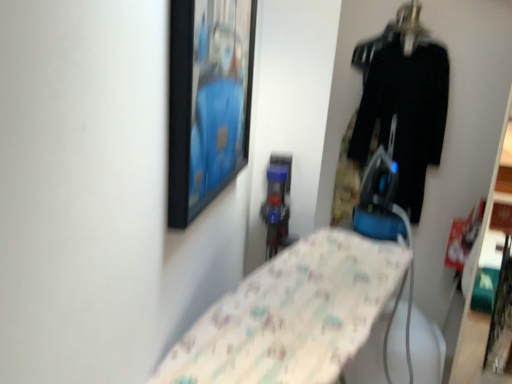
Where is `black matte picture frame at upper center`? This screenshot has height=384, width=512. black matte picture frame at upper center is located at coordinates (208, 101).

The height and width of the screenshot is (384, 512). Describe the element at coordinates (403, 103) in the screenshot. I see `black fabric pants at right` at that location.

Describe the element at coordinates (410, 26) in the screenshot. The height and width of the screenshot is (384, 512). I see `metallic hanger at upper right` at that location.

Identify the location of black matte picture frame at upper center. This screenshot has height=384, width=512. (208, 101).

Which object is wider, black matte picture frame at upper center or black fabric pants at right?

black fabric pants at right is wider.

Does black matte picture frame at upper center have a lesser height compared to black fabric pants at right?

Indeed, black matte picture frame at upper center has a lesser height compared to black fabric pants at right.

Is black matte picture frame at upper center positioned far away from black fabric pants at right?

Yes, black matte picture frame at upper center and black fabric pants at right are quite far apart.

From a real-world perspective, is black fabric pants at right positioned above or below metallic hanger at upper right?

In terms of real-world spatial position, black fabric pants at right is below metallic hanger at upper right.

Could you tell me if black fabric pants at right is facing metallic hanger at upper right?

No.

Between black matte picture frame at upper center and metallic hanger at upper right, which one has larger width?

metallic hanger at upper right.

From the image's perspective, would you say black matte picture frame at upper center is shown under metallic hanger at upper right?

Correct, black matte picture frame at upper center appears lower than metallic hanger at upper right in the image.

Considering the positions of objects black matte picture frame at upper center and metallic hanger at upper right in the image provided, who is more to the right, black matte picture frame at upper center or metallic hanger at upper right?

From the viewer's perspective, metallic hanger at upper right appears more on the right side.

Is black matte picture frame at upper center touching metallic hanger at upper right?

No, black matte picture frame at upper center is not in contact with metallic hanger at upper right.

Is metallic hanger at upper right positioned in front of black fabric pants at right?

Yes, metallic hanger at upper right is closer to the viewer.

Does point (420, 8) come closer to viewer compared to point (364, 111)?

Yes.

Between metallic hanger at upper right and black fabric pants at right, which one has smaller size?

With smaller size is metallic hanger at upper right.

What are the coordinates of `hanger lying on the left of black fabric pants at right` in the screenshot? It's located at (410, 26).

Considering the points (426, 36) and (181, 140), which point is in front, point (426, 36) or point (181, 140)?

The point (181, 140) is in front.

Locate an element on the screen. This screenshot has width=512, height=384. picture frame that is in front of the metallic hanger at upper right is located at coordinates (208, 101).

From a real-world perspective, is metallic hanger at upper right physically located above or below black matte picture frame at upper center?

From a real-world perspective, metallic hanger at upper right is physically above black matte picture frame at upper center.

Is metallic hanger at upper right thinner than black matte picture frame at upper center?

In fact, metallic hanger at upper right might be wider than black matte picture frame at upper center.

From a real-world perspective, does black fabric pants at right stand above black matte picture frame at upper center?

No, from a real-world perspective, black fabric pants at right is not on top of black matte picture frame at upper center.

Are black fabric pants at right and black matte picture frame at upper center located far from each other?

black fabric pants at right is positioned a significant distance from black matte picture frame at upper center.

From the image's perspective, is black fabric pants at right located above or below black matte picture frame at upper center?

Clearly, from the image's perspective, black fabric pants at right is above black matte picture frame at upper center.

How many degrees apart are the facing directions of black fabric pants at right and black matte picture frame at upper center?

There is a 84.4-degree angle between the facing directions of black fabric pants at right and black matte picture frame at upper center.

At what (x,y) coordinates should I click in order to perform the action: click on clothing on the right of black matte picture frame at upper center. Please return your answer as a coordinate pair (x, y). The width and height of the screenshot is (512, 384). Looking at the image, I should click on (403, 103).

The width and height of the screenshot is (512, 384). Find the location of `hanger located above the black fabric pants at right (from the image's perspective)`. hanger located above the black fabric pants at right (from the image's perspective) is located at coordinates (410, 26).

Based on their spatial positions, is black fabric pants at right or metallic hanger at upper right further from black matte picture frame at upper center?

Based on the image, metallic hanger at upper right appears to be further to black matte picture frame at upper center.

Considering their positions, is metallic hanger at upper right positioned closer to black matte picture frame at upper center than black fabric pants at right?

black fabric pants at right lies closer to black matte picture frame at upper center than the other object.

In the scene shown: Which object lies nearer to the anchor point black fabric pants at right, metallic hanger at upper right or black matte picture frame at upper center?

metallic hanger at upper right is closer to black fabric pants at right.

Estimate the real-world distances between objects in this image. Which object is closer to metallic hanger at upper right, black fabric pants at right or black matte picture frame at upper center?

The object closer to metallic hanger at upper right is black fabric pants at right.

Based on their spatial positions, is black matte picture frame at upper center or metallic hanger at upper right further from black fabric pants at right?

black matte picture frame at upper center is positioned further to the anchor black fabric pants at right.

When comparing their distances from metallic hanger at upper right, does black matte picture frame at upper center or black fabric pants at right seem further?

Based on the image, black matte picture frame at upper center appears to be further to metallic hanger at upper right.

Where is `hanger between black matte picture frame at upper center and black fabric pants at right from front to back`? hanger between black matte picture frame at upper center and black fabric pants at right from front to back is located at coordinates (410, 26).